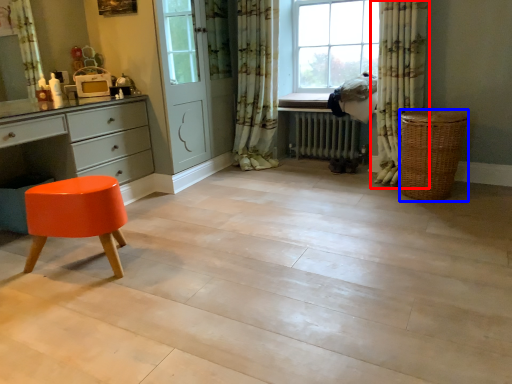
Question: Which of the following is the closest to the observer, curtain (highlighted by a red box) or basket (highlighted by a blue box)?

Choices:
 (A) curtain
 (B) basket

Answer: (B)